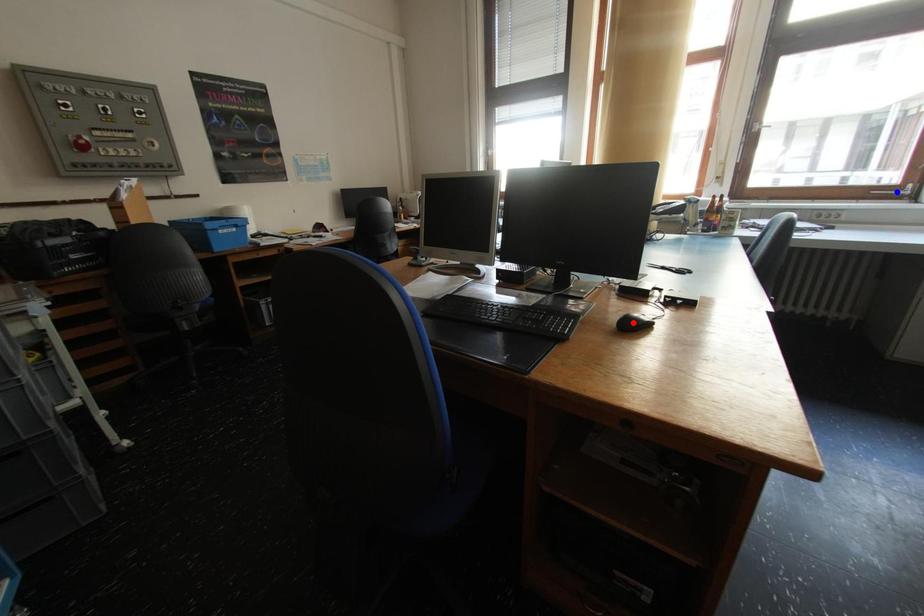
Question: Two points are marked on the image. Which point is closer to the camera?

Choices:
 (A) Blue point is closer.
 (B) Red point is closer.

Answer: (B)